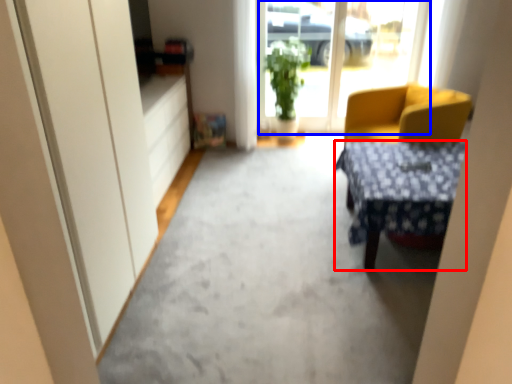
Question: Which object appears farthest to the camera in this image, desk (highlighted by a red box) or window screen (highlighted by a blue box)?

Choices:
 (A) desk
 (B) window screen

Answer: (B)